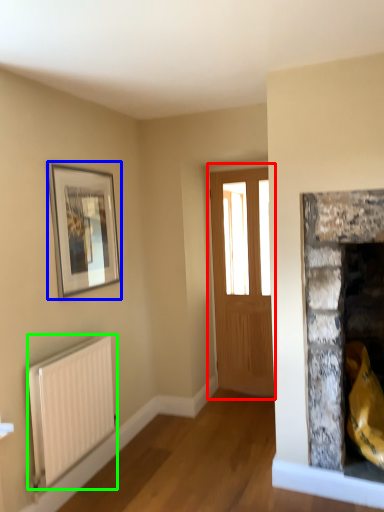
Question: Which object is the closest to the window (highlighted by a red box)? Choose among these: picture frame (highlighted by a blue box) or radiator (highlighted by a green box).

Choices:
 (A) picture frame
 (B) radiator

Answer: (A)